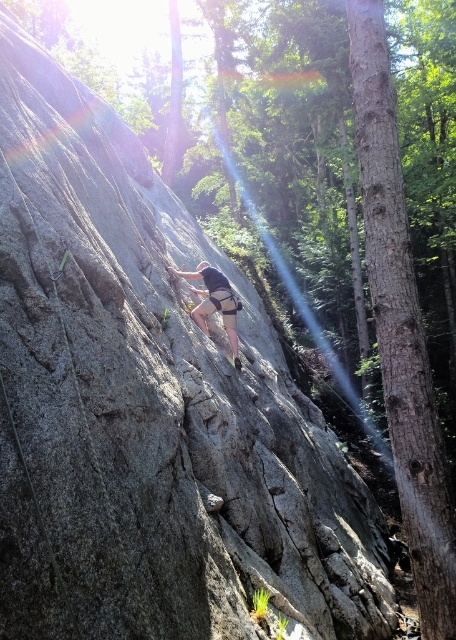
Question: Is brown rough bark tree at right positioned behind matte gray climbing harness at center?

Choices:
 (A) yes
 (B) no

Answer: (B)

Question: Among these objects, which one is nearest to the camera?

Choices:
 (A) brown rough bark tree at right
 (B) matte gray climbing harness at center

Answer: (A)

Question: Where is brown rough bark tree at right located in relation to matte gray climbing harness at center in the image?

Choices:
 (A) left
 (B) right

Answer: (B)

Question: Is brown rough bark tree at right further to the viewer compared to matte gray climbing harness at center?

Choices:
 (A) no
 (B) yes

Answer: (A)